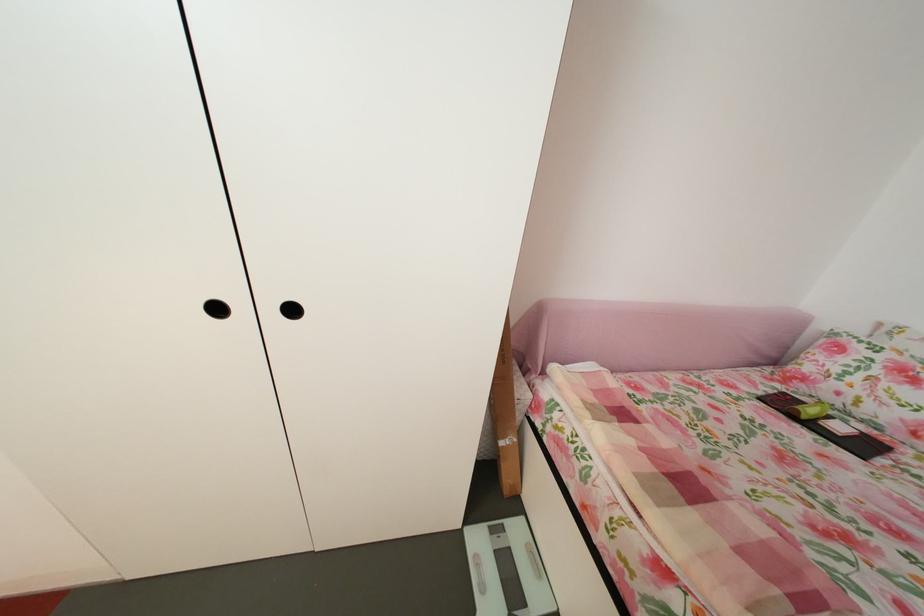
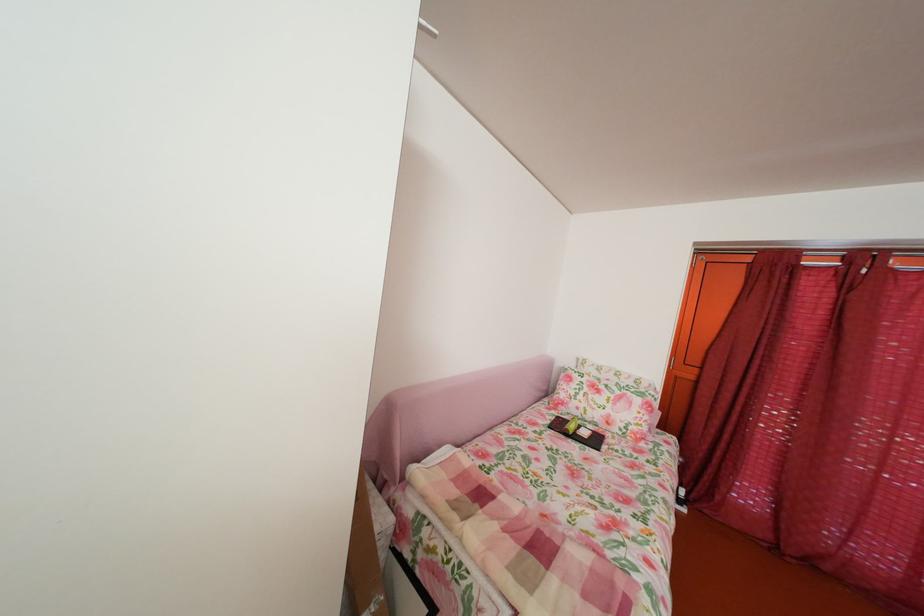
Question: How did the camera likely rotate?

Choices:
 (A) Left
 (B) Right
 (C) Up
 (D) Down

Answer: (B)